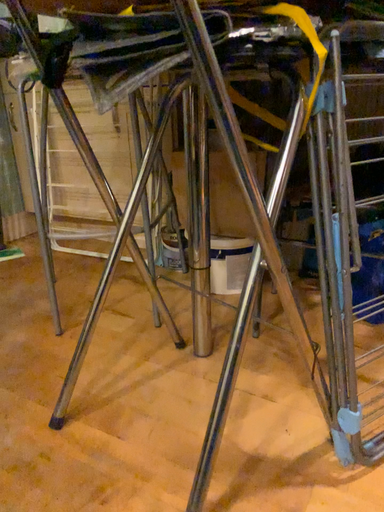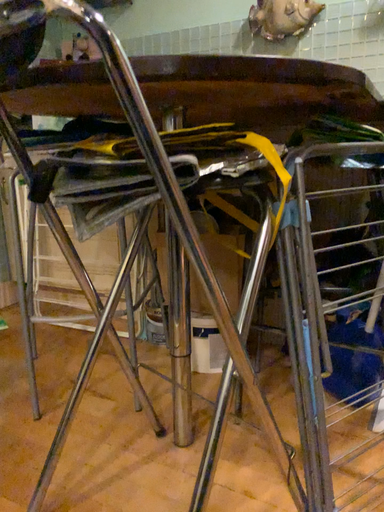
Question: Which way did the camera rotate in the video?

Choices:
 (A) rotated upward
 (B) rotated downward

Answer: (A)